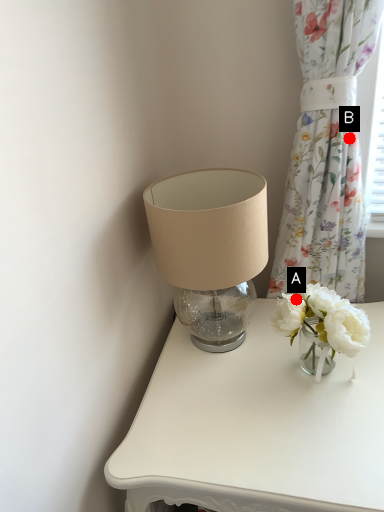
Question: Two points are circled on the image, labeled by A and B beside each circle. Which point is farther from the camera taking this photo?

Choices:
 (A) A is further
 (B) B is further

Answer: (B)